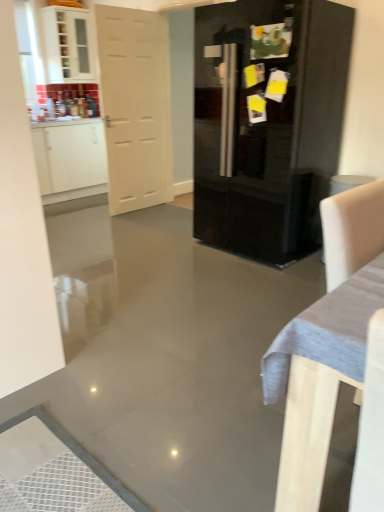
Question: Is point (291, 167) closer or farther from the camera than point (165, 78)?

Choices:
 (A) farther
 (B) closer

Answer: (B)

Question: Is glossy black refrigerator at center taller or shorter than white matte door at left?

Choices:
 (A) tall
 (B) short

Answer: (B)

Question: Estimate the real-world distances between objects in this image. Which object is farther from the white fabric armchair at right?

Choices:
 (A) white matte door at left
 (B) white glossy cabinet at upper left, marked as the second cabinetry in a top-to-bottom arrangement
 (C) glossy black refrigerator at center
 (D) white glossy cabinet at upper left, positioned as the 1th cabinetry in top-to-bottom order

Answer: (D)

Question: Which object is positioned farthest from the white glossy cabinet at upper left, positioned as the second cabinetry in bottom-to-top order?

Choices:
 (A) white fabric armchair at right
 (B) white matte door at left
 (C) white glossy cabinet at upper left, the 1th cabinetry positioned from the bottom
 (D) glossy black refrigerator at center

Answer: (A)